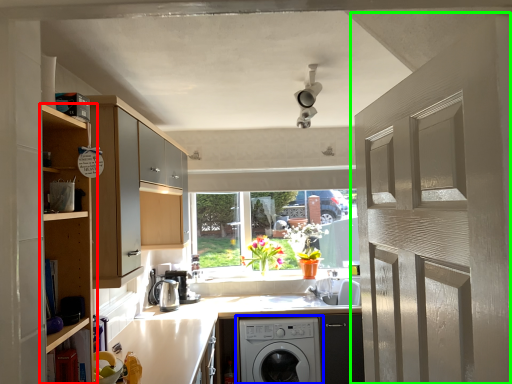
Question: Which object is the farthest from cabinetry (highlighted by a red box)? Choose among these: washing machine (highlighted by a blue box) or door (highlighted by a green box).

Choices:
 (A) washing machine
 (B) door

Answer: (A)